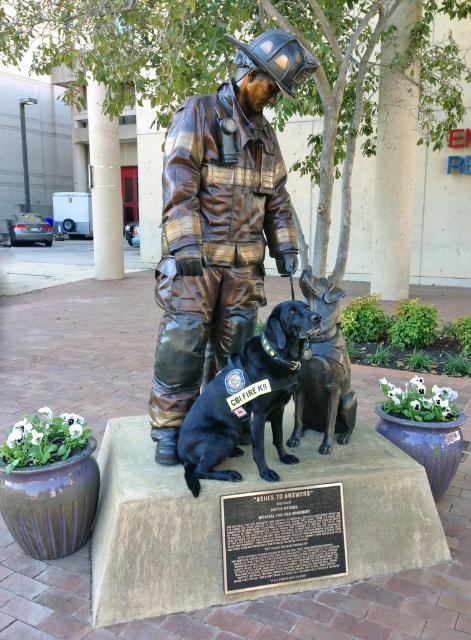
Question: Which point appears farthest from the camera in this image?

Choices:
 (A) click(258, 460)
 (B) click(169, 401)
 (C) click(295, 419)

Answer: (C)

Question: Does bronze statue at center come behind shiny black dog at center?

Choices:
 (A) yes
 (B) no

Answer: (A)

Question: Which object appears farthest from the camera in this image?

Choices:
 (A) black glossy dog at center
 (B) shiny black dog at center
 (C) bronze statue at center

Answer: (C)

Question: Does bronze statue at center have a larger size compared to shiny black dog at center?

Choices:
 (A) yes
 (B) no

Answer: (A)

Question: Which point is farther to the camera?

Choices:
 (A) (172, 420)
 (B) (349, 390)
 (C) (199, 472)

Answer: (B)

Question: Is shiny black dog at center wider than black glossy dog at center?

Choices:
 (A) no
 (B) yes

Answer: (B)